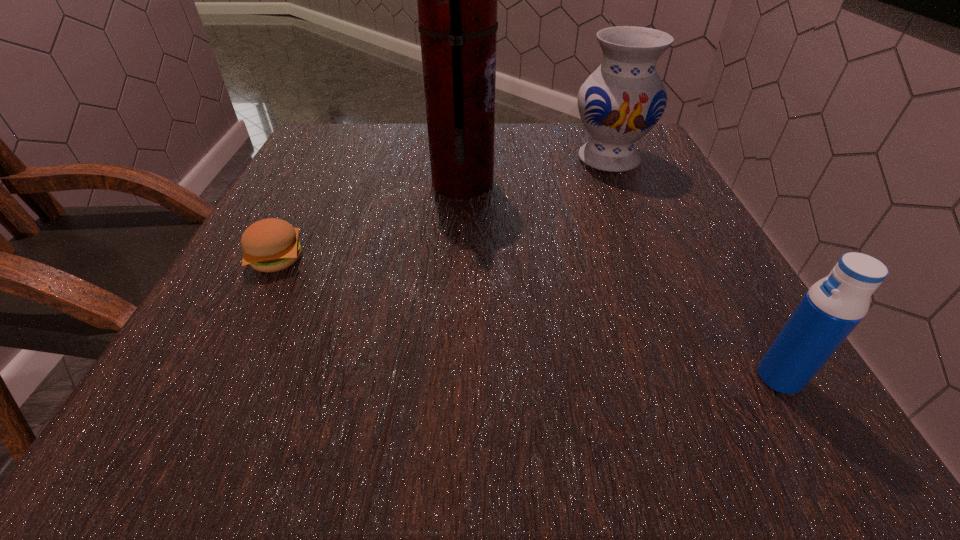
Locate an element on the screen. The image size is (960, 540). vacant space at the near edge of the desktop is located at coordinates (454, 388).

Find the location of a particular element. Image resolution: width=960 pixels, height=540 pixels. free space at the left edge of the desktop is located at coordinates (310, 276).

You are a GUI agent. You are given a task and a screenshot of the screen. Output one action in this format:
    pyautogui.click(x=<x>, y=<y>)
    Task: Click on the free space at the right edge of the desktop
    The image size is (960, 540).
    Given the screenshot: What is the action you would take?
    pyautogui.click(x=680, y=204)

Where is `vacant space at the far left corner of the desktop`? vacant space at the far left corner of the desktop is located at coordinates (324, 163).

Locate an element on the screen. The height and width of the screenshot is (540, 960). vacant space at the near left corner of the desktop is located at coordinates (267, 405).

In the image, there is a desktop. Find the location of `vacant space at the near right corner`. vacant space at the near right corner is located at coordinates (784, 448).

Where is `empty location between the water bottle and the vase`? The image size is (960, 540). empty location between the water bottle and the vase is located at coordinates (694, 268).

Locate an element on the screen. empty location between the shortest object and the second shortest object is located at coordinates (528, 318).

Where is `empty space between the fire extinguisher and the nearest object`? The height and width of the screenshot is (540, 960). empty space between the fire extinguisher and the nearest object is located at coordinates (621, 280).

What are the coordinates of `empty space between the fire extinguisher and the vase` in the screenshot? It's located at (536, 171).